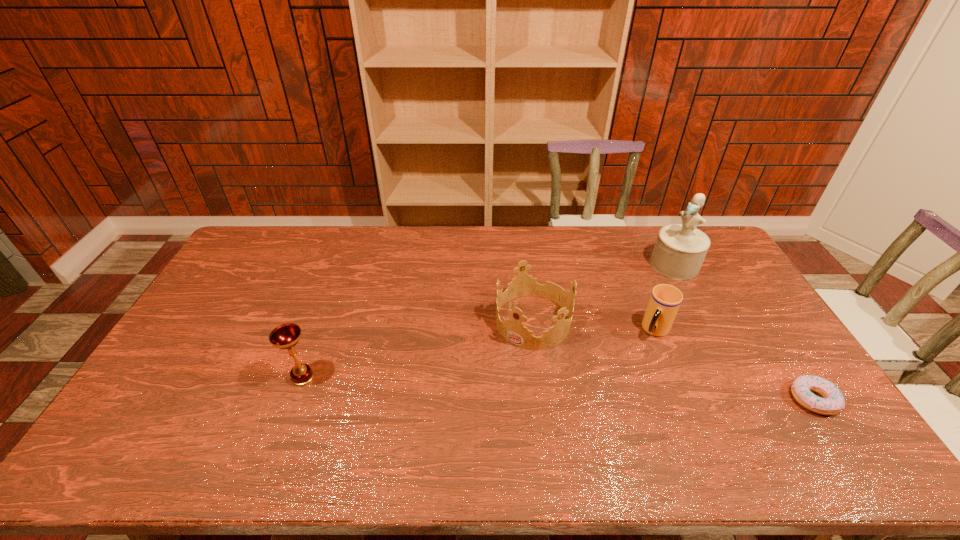
Where is `free space located at the beak of the figurine`? free space located at the beak of the figurine is located at coordinates (625, 301).

I want to click on blank space located 0.220m at the beak of the figurine, so click(x=624, y=303).

The image size is (960, 540). In order to click on vacant space located 0.160m on the front-facing side of the tiara in this screenshot , I will do `click(487, 383)`.

Identify the location of free region located on the front-facing side of the tiara. Image resolution: width=960 pixels, height=540 pixels. (483, 388).

The width and height of the screenshot is (960, 540). I want to click on vacant area situated on the front-facing side of the tiara, so click(483, 388).

Where is `free space located 0.220m on the side of the third object from right to left with the handle`? The height and width of the screenshot is (540, 960). free space located 0.220m on the side of the third object from right to left with the handle is located at coordinates (618, 388).

What are the coordinates of `vacant area situated 0.090m on the side of the third object from right to left with the handle` in the screenshot? It's located at (637, 359).

Find the location of a particular element. The width and height of the screenshot is (960, 540). vacant space located 0.130m on the side of the third object from right to left with the handle is located at coordinates (633, 367).

At what (x,y) coordinates should I click in order to perform the action: click on object at the far edge. Please return your answer as a coordinate pair (x, y). Looking at the image, I should click on (680, 249).

The width and height of the screenshot is (960, 540). I want to click on object at the near edge, so click(x=832, y=403).